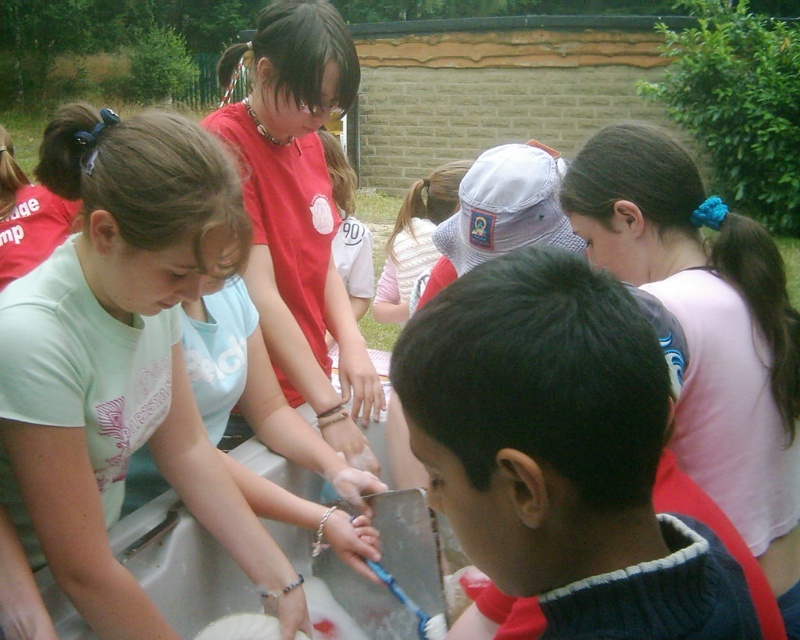
You are a photographer trying to capture the scene of the children around the sink. You want to focus on the white matte hand at center. Based on its coordinates, where should you position your camera to ensure it is centered in the frame?

The white matte hand at center is located at point coordinates 0.689 on the x axis and 0.435 on the y axis. To center it in your frame, position your camera so the hand is at the center point of your viewfinder, aligning with these coordinates.

You are a tailor trying to decide if a dark blue sweater at center can fit over a white matte hand at center. Based on the size comparison, will the sweater fit over the hand?

The dark blue sweater at center is larger in size than the white matte hand at center, so the sweater can fit over the hand.